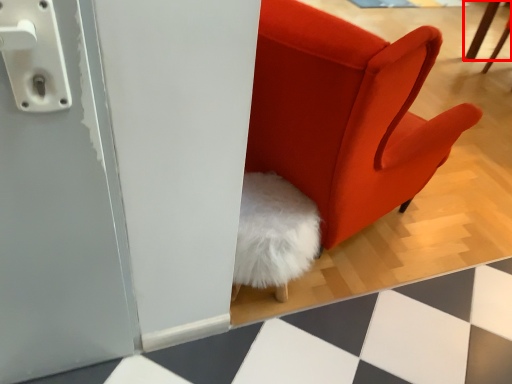
Question: Where is furniture (annotated by the red box) located in relation to chair in the image?

Choices:
 (A) right
 (B) left

Answer: (A)